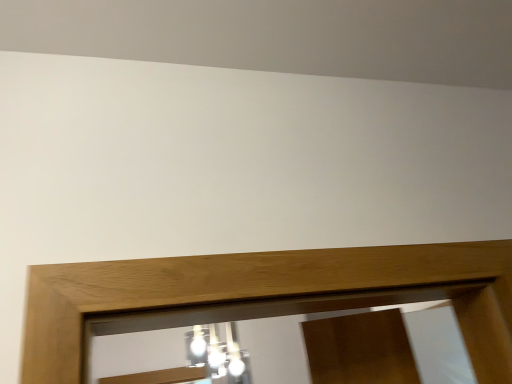
Where is `white glossy light fixture at center`? white glossy light fixture at center is located at coordinates (218, 354).

What do you see at coordinates (218, 354) in the screenshot? The height and width of the screenshot is (384, 512). I see `white glossy light fixture at center` at bounding box center [218, 354].

Measure the distance between point (234, 341) and camera.

Point (234, 341) is 3.06 meters away from camera.

What is the approximate width of white glossy light fixture at center?

white glossy light fixture at center is 2.79 inches wide.

What is the approximate height of white glossy light fixture at center?

15.00 inches.

What are the coordinates of `white glossy light fixture at center` in the screenshot? It's located at (218, 354).